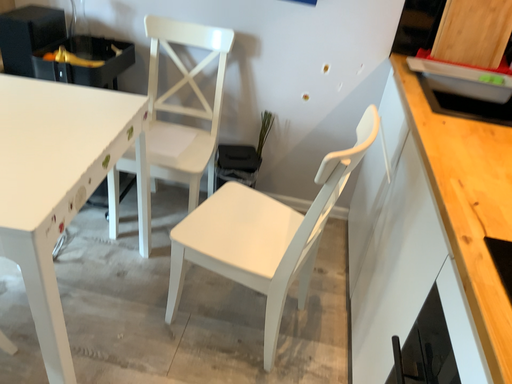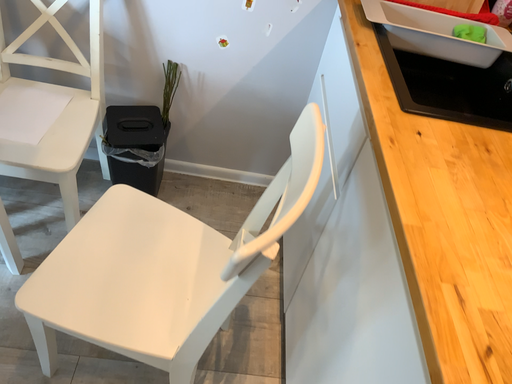
Question: Which way did the camera rotate in the video?

Choices:
 (A) rotated left
 (B) rotated right

Answer: (B)